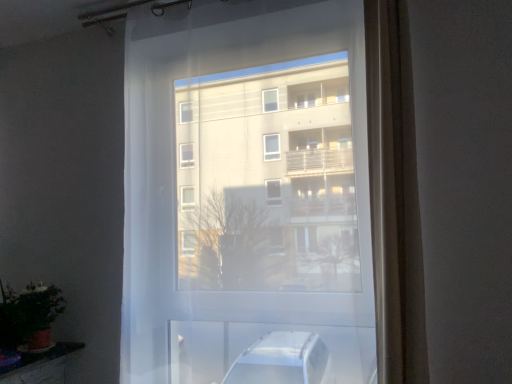
Question: Considering the relative sizes of transparent fabric at center and satin beige curtain at right in the image provided, is transparent fabric at center wider than satin beige curtain at right?

Choices:
 (A) yes
 (B) no

Answer: (B)

Question: Can you confirm if transparent fabric at center is thinner than satin beige curtain at right?

Choices:
 (A) no
 (B) yes

Answer: (B)

Question: Is transparent fabric at center far away from satin beige curtain at right?

Choices:
 (A) yes
 (B) no

Answer: (B)

Question: Is transparent fabric at center facing towards satin beige curtain at right?

Choices:
 (A) yes
 (B) no

Answer: (B)

Question: Considering the relative positions of transparent fabric at center and satin beige curtain at right in the image provided, is transparent fabric at center to the left of satin beige curtain at right from the viewer's perspective?

Choices:
 (A) no
 (B) yes

Answer: (B)

Question: Is green matte plant at lower left in front of or behind satin beige curtain at right in the image?

Choices:
 (A) front
 (B) behind

Answer: (B)

Question: Based on their sizes in the image, would you say green matte plant at lower left is bigger or smaller than satin beige curtain at right?

Choices:
 (A) small
 (B) big

Answer: (A)

Question: Is green matte plant at lower left inside the boundaries of satin beige curtain at right, or outside?

Choices:
 (A) inside
 (B) outside

Answer: (B)

Question: From the image's perspective, is green matte plant at lower left positioned above or below satin beige curtain at right?

Choices:
 (A) below
 (B) above

Answer: (A)

Question: Considering the positions of transparent fabric at center and satin beige curtain at right in the image, is transparent fabric at center taller or shorter than satin beige curtain at right?

Choices:
 (A) tall
 (B) short

Answer: (A)

Question: From the image's perspective, is transparent fabric at center positioned above or below satin beige curtain at right?

Choices:
 (A) above
 (B) below

Answer: (B)

Question: Would you say transparent fabric at center is to the left or to the right of satin beige curtain at right in the picture?

Choices:
 (A) left
 (B) right

Answer: (A)

Question: In the image, is transparent fabric at center positioned in front of or behind satin beige curtain at right?

Choices:
 (A) front
 (B) behind

Answer: (B)

Question: Considering the positions of satin beige curtain at right and green matte plant at lower left in the image, is satin beige curtain at right bigger or smaller than green matte plant at lower left?

Choices:
 (A) big
 (B) small

Answer: (A)

Question: From their relative heights in the image, would you say satin beige curtain at right is taller or shorter than green matte plant at lower left?

Choices:
 (A) short
 (B) tall

Answer: (B)